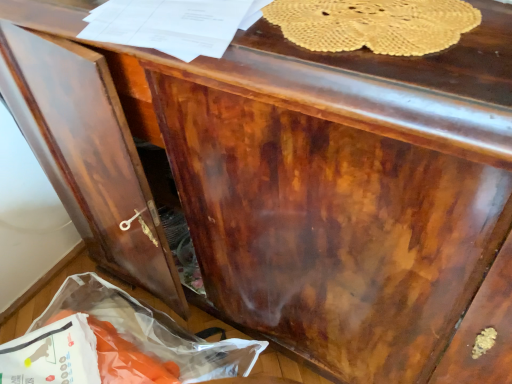
What do you see at coordinates (373, 24) in the screenshot? This screenshot has width=512, height=384. I see `yellow crocheted doily at upper center` at bounding box center [373, 24].

The height and width of the screenshot is (384, 512). In order to click on yellow crocheted doily at upper center in this screenshot , I will do `click(373, 24)`.

At what (x,y) coordinates should I click in order to perform the action: click on yellow crocheted doily at upper center. Please return your answer as a coordinate pair (x, y). Looking at the image, I should click on (373, 24).